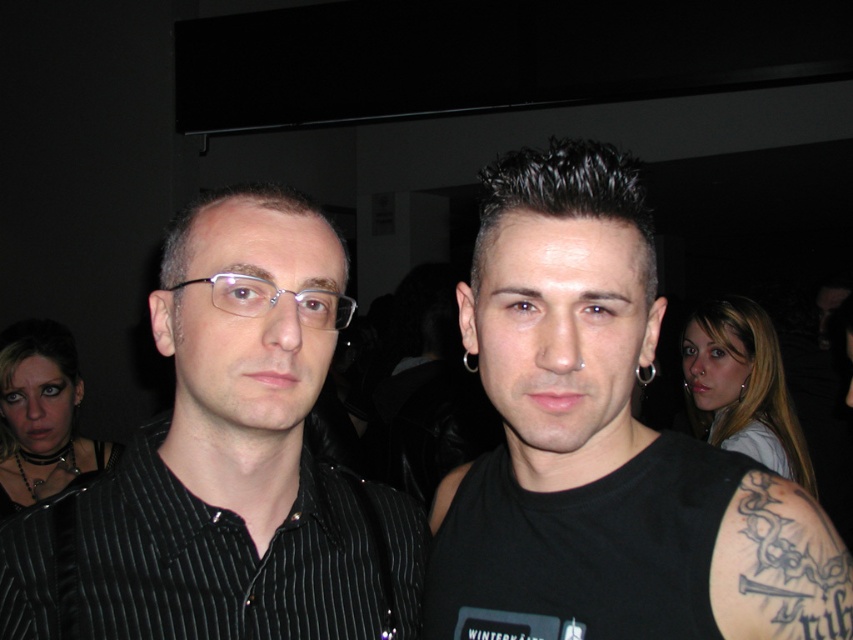
Question: Which of these objects is positioned farthest from the clear plastic glasses at center?

Choices:
 (A) black matte tank top at center
 (B) black pinstripe shirt at left

Answer: (A)

Question: Which object is closer to the camera taking this photo?

Choices:
 (A) clear plastic glasses at center
 (B) black matte tank top at center
 (C) black pinstripe shirt at left

Answer: (B)

Question: Which point is farther from the camera taking this photo?

Choices:
 (A) (219, 284)
 (B) (44, 561)
 (C) (515, 420)

Answer: (B)

Question: Can you confirm if black matte tank top at center is positioned to the right of black pinstripe shirt at left?

Choices:
 (A) no
 (B) yes

Answer: (B)

Question: Does black matte tank top at center have a smaller size compared to clear plastic glasses at center?

Choices:
 (A) no
 (B) yes

Answer: (A)

Question: Is black pinstripe shirt at left below clear plastic glasses at center?

Choices:
 (A) no
 (B) yes

Answer: (B)